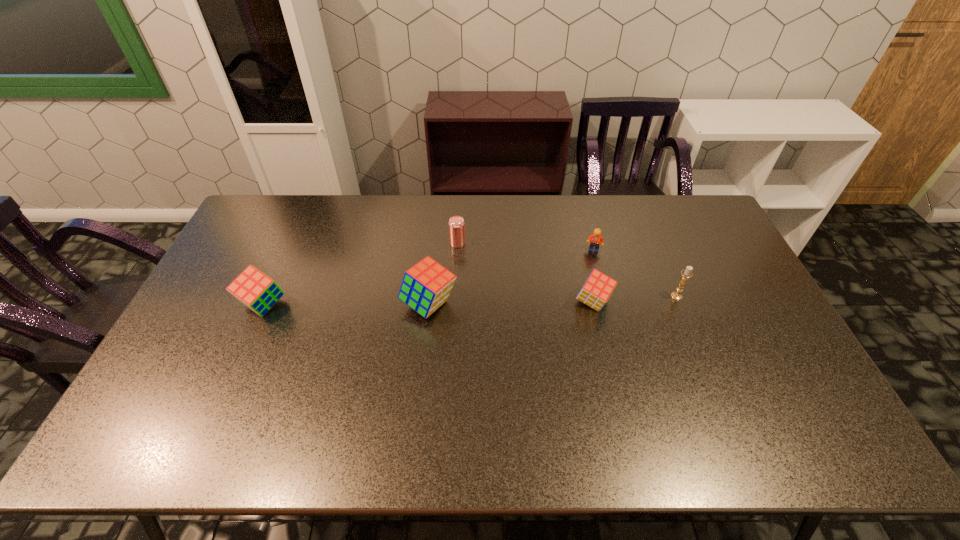
All cubes are currently evenly spaced. To continue this pattern, where would you add another cube on the right? Please point out a vacant spot. Please provide its 2D coordinates. Your answer should be formatted as a tuple, i.e. [(x, y)], where the tuple contains the x and y coordinates of a point satisfying the conditions above.

[(756, 301)]